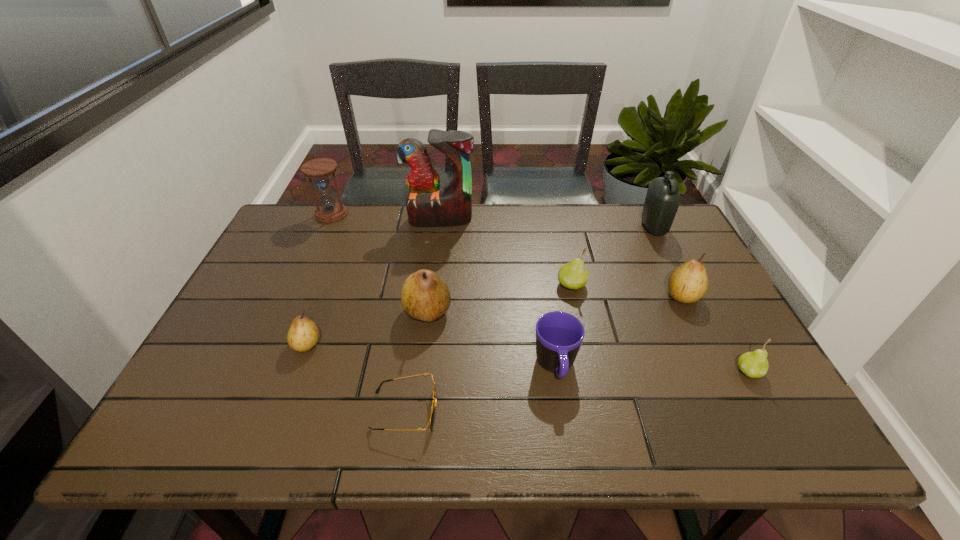
Image resolution: width=960 pixels, height=540 pixels. What are the coordinates of `free spot that satisfies the following two spatial constraints: 1. at the face of the right green pear; 2. on the right side of the parrot` in the screenshot? It's located at (422, 372).

Locate an element on the screen. The width and height of the screenshot is (960, 540). free location that satisfies the following two spatial constraints: 1. at the face of the parrot; 2. on the front-facing side of the sunglasses is located at coordinates (418, 411).

Identify the location of vacant space that satisfies the following two spatial constraints: 1. at the face of the rightmost brown pear; 2. on the right side of the parrot. This screenshot has height=540, width=960. coord(431,296).

Locate an element on the screen. vacant space that satisfies the following two spatial constraints: 1. at the face of the parrot; 2. on the right side of the bottle is located at coordinates (440, 227).